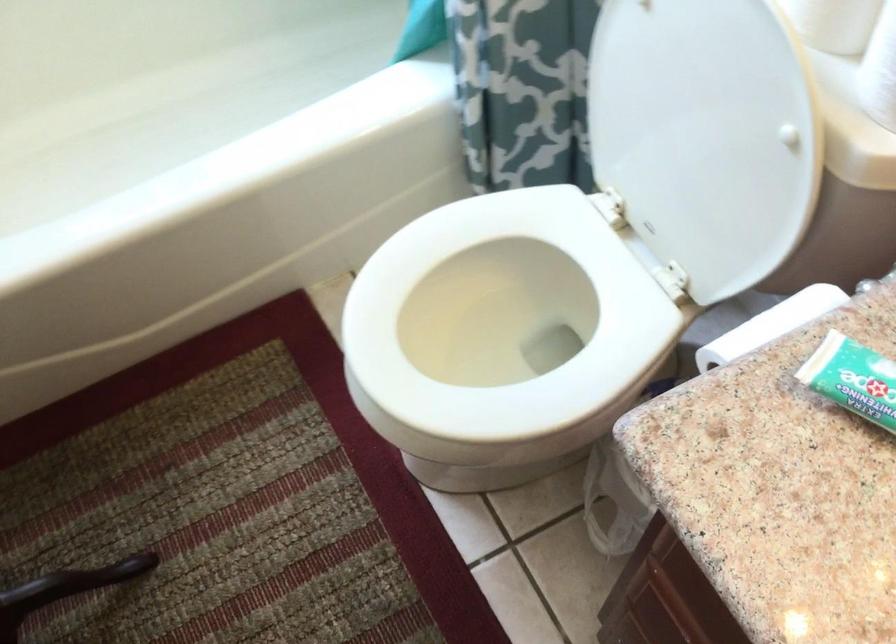
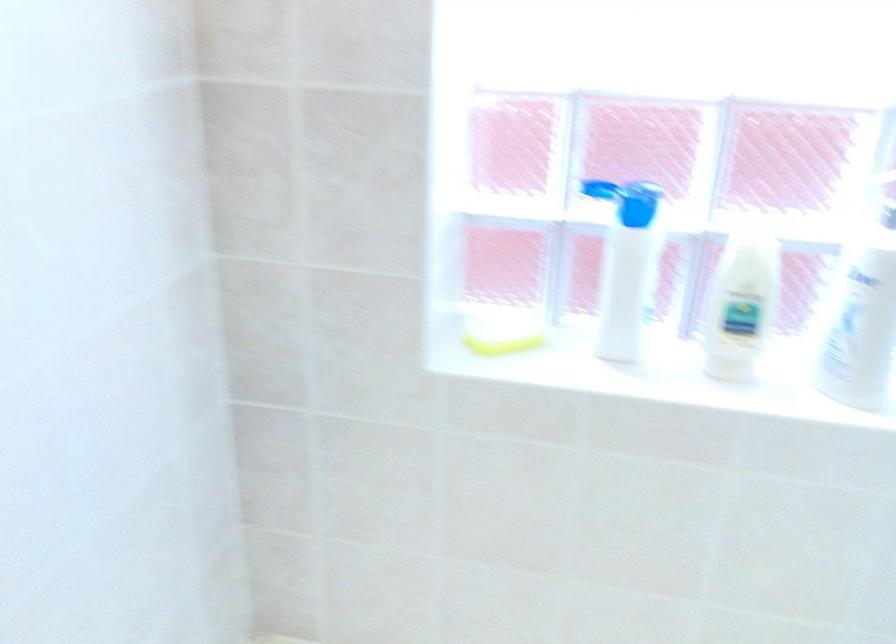
How did the camera likely rotate?

The camera rotated toward left-up.